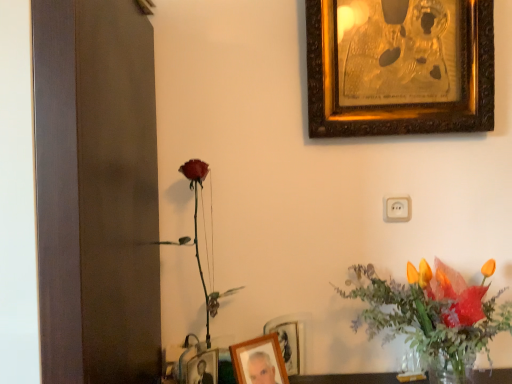
Question: From a real-world perspective, is white plastic electric outlet at center positioned under wooden photo frame at lower center, which is the second picture frame in left-to-right order, based on gravity?

Choices:
 (A) yes
 (B) no

Answer: (B)

Question: Is white plastic electric outlet at center in contact with wooden photo frame at lower center, the 3th picture frame viewed from the top?

Choices:
 (A) yes
 (B) no

Answer: (B)

Question: Is white plastic electric outlet at center oriented away from wooden photo frame at lower center, which appears as the second picture frame when viewed from the front?

Choices:
 (A) no
 (B) yes

Answer: (A)

Question: From the image's perspective, would you say white plastic electric outlet at center is shown under wooden photo frame at lower center, which is the second picture frame in left-to-right order?

Choices:
 (A) yes
 (B) no

Answer: (B)

Question: Would you say white plastic electric outlet at center contains wooden photo frame at lower center, which is the second picture frame in left-to-right order?

Choices:
 (A) yes
 (B) no

Answer: (B)

Question: Is wooden photo frame at lower center, the 2th picture frame positioned from the top, wider or thinner than white plastic electric outlet at center?

Choices:
 (A) thin
 (B) wide

Answer: (B)

Question: In terms of size, does wooden photo frame at lower center, the first picture frame positioned from the front, appear bigger or smaller than white plastic electric outlet at center?

Choices:
 (A) big
 (B) small

Answer: (A)

Question: From the image's perspective, is wooden photo frame at lower center, which is counted as the third picture frame, starting from the right, located above or below white plastic electric outlet at center?

Choices:
 (A) below
 (B) above

Answer: (A)

Question: Considering the positions of point (272, 349) and point (387, 205), is point (272, 349) closer or farther from the camera than point (387, 205)?

Choices:
 (A) farther
 (B) closer

Answer: (B)

Question: From the image's perspective, is translucent glass vase at lower right positioned above or below wooden photo frame at lower center, which appears as the second picture frame when viewed from the back?

Choices:
 (A) below
 (B) above

Answer: (B)

Question: In the image, is translucent glass vase at lower right positioned in front of or behind wooden photo frame at lower center, the 3th picture frame viewed from the top?

Choices:
 (A) behind
 (B) front

Answer: (B)

Question: Is translucent glass vase at lower right wider or thinner than wooden photo frame at lower center, which is the second picture frame in left-to-right order?

Choices:
 (A) thin
 (B) wide

Answer: (B)

Question: From a real-world perspective, is translucent glass vase at lower right positioned above or below wooden photo frame at lower center, the first picture frame in the bottom-to-top sequence?

Choices:
 (A) above
 (B) below

Answer: (A)

Question: From the image's perspective, is gold ornate picture frame at upper right, acting as the 3th picture frame starting from the left, above or below wooden photo frame at lower center, which is counted as the third picture frame, starting from the right?

Choices:
 (A) above
 (B) below

Answer: (A)

Question: Would you say gold ornate picture frame at upper right, acting as the 3th picture frame starting from the left, is to the left or to the right of wooden photo frame at lower center, the first picture frame positioned from the front, in the picture?

Choices:
 (A) left
 (B) right

Answer: (B)